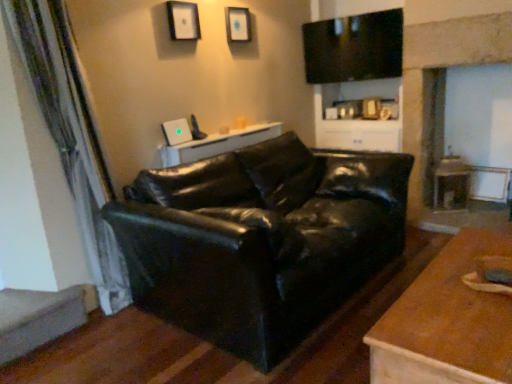
Where is `vacant space underneath green textured curtain at left (from a real-world perspective)`? vacant space underneath green textured curtain at left (from a real-world perspective) is located at coordinates (100, 323).